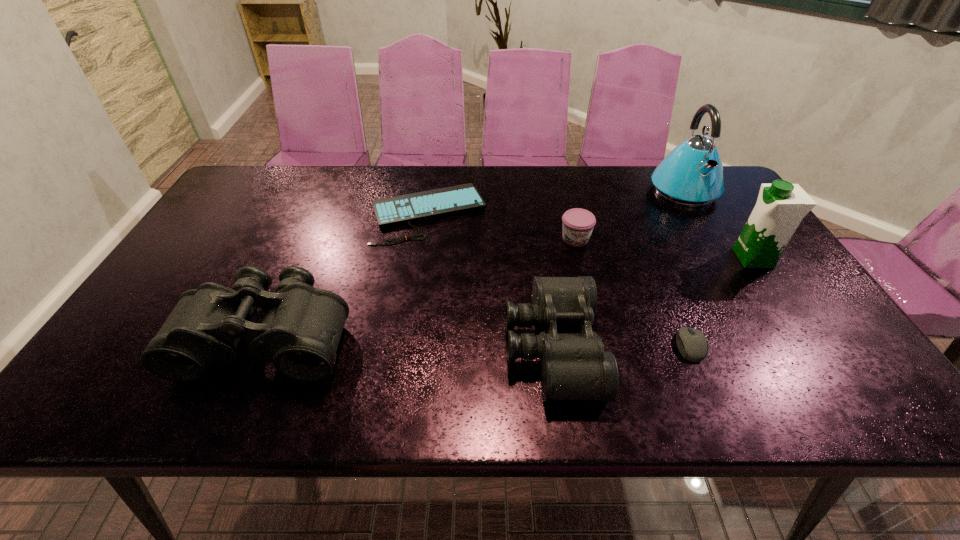
I want to click on free space between the jam and the tallest object, so click(629, 214).

Find the location of a particular element. free point between the second tallest object and the fourth shortest object is located at coordinates (653, 302).

This screenshot has height=540, width=960. I want to click on vacant space that is in between the fourth tallest object and the kettle, so click(x=617, y=268).

I want to click on vacant space in between the computer equipment and the third shortest object, so click(633, 292).

The height and width of the screenshot is (540, 960). In order to click on empty space that is in between the third shortest object and the fifth shortest object in this screenshot , I will do `click(421, 288)`.

Where is `vacant area that lies between the soya milk and the fourth shortest object`? This screenshot has height=540, width=960. vacant area that lies between the soya milk and the fourth shortest object is located at coordinates (653, 302).

The width and height of the screenshot is (960, 540). I want to click on unoccupied position between the second tallest object and the shorter binoculars, so click(x=653, y=302).

At what (x,y) coordinates should I click in order to perform the action: click on vacant space in between the sixth shortest object and the tallest object. Please return your answer as a coordinate pair (x, y). Looking at the image, I should click on pyautogui.click(x=718, y=224).

Identify the location of vacant area between the kettle and the third shortest object. This screenshot has height=540, width=960. (629, 214).

Select which object appears as the closest to the computer keyboard. Please provide its 2D coordinates. Your answer should be formatted as a tuple, i.e. [(x, y)], where the tuple contains the x and y coordinates of a point satisfying the conditions above.

[(574, 366)]